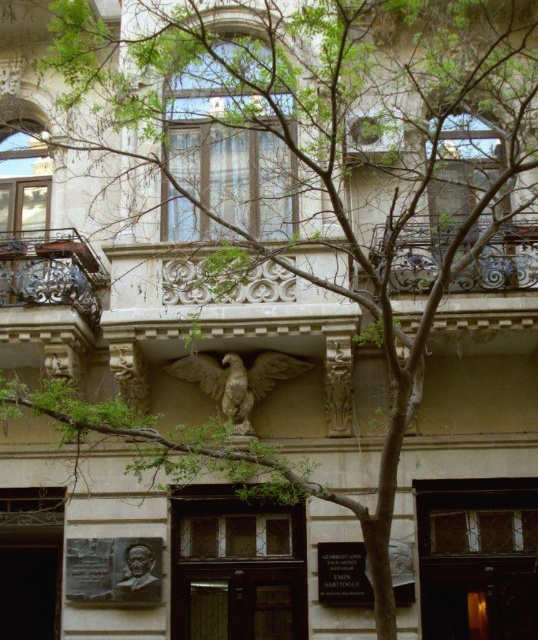
Is dark brown wrought iron balcony at left thinner than bronze relief at lower center?

Incorrect, dark brown wrought iron balcony at left's width is not less than bronze relief at lower center's.

Who is shorter, dark brown wrought iron balcony at left or bronze relief at lower center?

bronze relief at lower center

Identify the location of dark brown wrought iron balcony at left. The image size is (538, 640). (51, 273).

Who is more distant from viewer, (249, 372) or (19, 292)?

The point (249, 372) is behind.

Which is below, stone eagle at center or dark brown ornate metalwork at left?

Positioned lower is stone eagle at center.

Which is in front, point (221, 392) or point (58, 268)?

Positioned in front is point (58, 268).

Image resolution: width=538 pixels, height=640 pixels. Find the location of `stone eagle at center`. stone eagle at center is located at coordinates (237, 380).

Which is above, dark brown wrought iron balcony at left or dark brown ornate metalwork at left?

dark brown wrought iron balcony at left is higher up.

Can you confirm if dark brown wrought iron balcony at left is taller than dark brown ornate metalwork at left?

Yes.

Is point (3, 240) positioned before point (36, 259)?

No, it is behind (36, 259).

At what (x,y) coordinates should I click in order to perform the action: click on dark brown wrought iron balcony at left. Please return your answer as a coordinate pair (x, y). The height and width of the screenshot is (640, 538). Looking at the image, I should click on (51, 273).